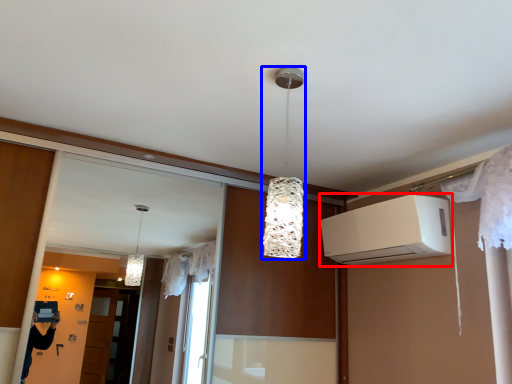
Question: Among these objects, which one is farthest to the camera, air conditioning (highlighted by a red box) or lamp (highlighted by a blue box)?

Choices:
 (A) air conditioning
 (B) lamp

Answer: (A)